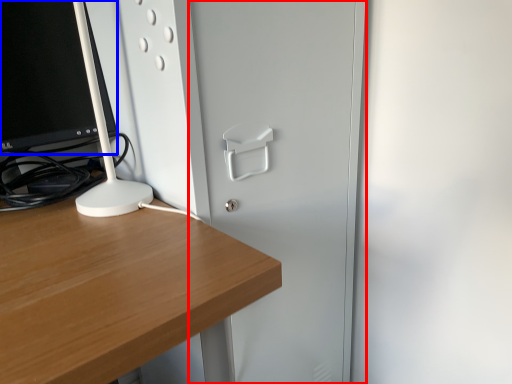
Question: Which object appears farthest to the camera in this image, glass door (highlighted by a red box) or computer monitor (highlighted by a blue box)?

Choices:
 (A) glass door
 (B) computer monitor

Answer: (B)